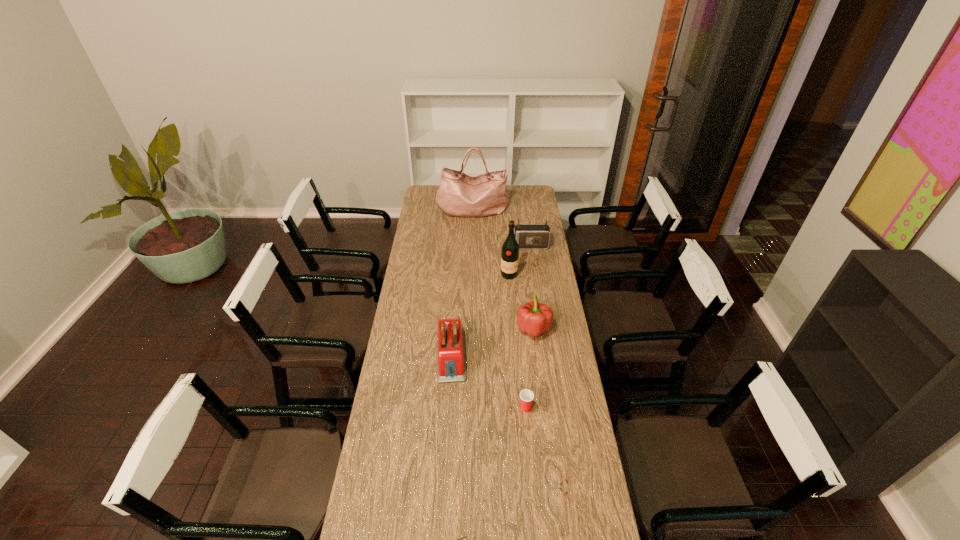
Where is `free spot between the bell pepper and the liquor`? This screenshot has width=960, height=540. free spot between the bell pepper and the liquor is located at coordinates (521, 302).

This screenshot has height=540, width=960. In order to click on free space between the liquor and the bell pepper in this screenshot , I will do `click(521, 302)`.

Image resolution: width=960 pixels, height=540 pixels. In order to click on unoccupied area between the third shortest object and the toaster in this screenshot , I will do `click(489, 381)`.

Locate an element on the screen. The width and height of the screenshot is (960, 540). vacant space that's between the second farthest object and the handbag is located at coordinates (500, 228).

The width and height of the screenshot is (960, 540). I want to click on free space between the bell pepper and the Dixie cup, so click(x=529, y=368).

This screenshot has width=960, height=540. Identify the location of free spot between the seventh farthest object and the camcorder. (545, 367).

This screenshot has width=960, height=540. Find the location of `the fifth closest object relative to the bell pepper`. the fifth closest object relative to the bell pepper is located at coordinates (557, 486).

Identify the location of object that is the fourth nearest to the Dixie cup. The height and width of the screenshot is (540, 960). (459, 539).

Where is `free space that satisfies the following two spatial constraints: 1. at the lens of the camcorder; 2. on the front-facing side of the liquor`? The width and height of the screenshot is (960, 540). free space that satisfies the following two spatial constraints: 1. at the lens of the camcorder; 2. on the front-facing side of the liquor is located at coordinates (532, 275).

At what (x,y) coordinates should I click in order to perform the action: click on free space that satisfies the following two spatial constraints: 1. on the back side of the sixth tallest object; 2. on the right side of the bell pepper. Please return your answer as a coordinate pair (x, y). The height and width of the screenshot is (540, 960). Looking at the image, I should click on (518, 329).